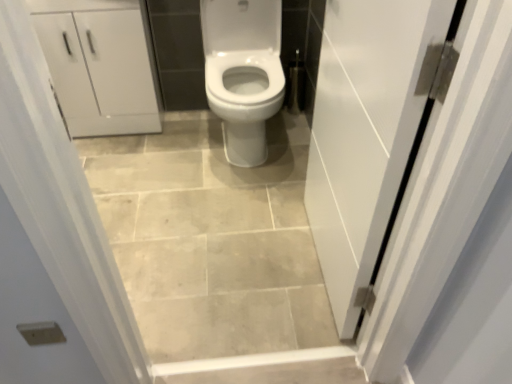
Describe the element at coordinates (99, 69) in the screenshot. The height and width of the screenshot is (384, 512). I see `white matte cabinet at upper left` at that location.

Where is `white matte cabinet at upper left`? The image size is (512, 384). white matte cabinet at upper left is located at coordinates (99, 69).

Identify the location of beige ceramic tile at center. The width and height of the screenshot is (512, 384). (211, 239).

Is point (253, 327) less distant than point (351, 92)?

That is False.

Considering the relative positions of beige ceramic tile at center and white glossy door at right in the image provided, is beige ceramic tile at center to the left of white glossy door at right from the viewer's perspective?

Indeed, beige ceramic tile at center is positioned on the left side of white glossy door at right.

The height and width of the screenshot is (384, 512). Find the location of `door positioned vertically above the beige ceramic tile at center (from a real-world perspective)`. door positioned vertically above the beige ceramic tile at center (from a real-world perspective) is located at coordinates (366, 134).

Which is behind, beige ceramic tile at center or white glossy door at right?

beige ceramic tile at center is further from the camera.

Looking at this image, looking at the image, does white matte cabinet at upper left seem bigger or smaller compared to beige ceramic tile at center?

Clearly, white matte cabinet at upper left is larger in size than beige ceramic tile at center.

From the image's perspective, which object appears higher, white matte cabinet at upper left or beige ceramic tile at center?

white matte cabinet at upper left.

From a real-world perspective, is white matte cabinet at upper left positioned over beige ceramic tile at center based on gravity?

Indeed, from a real-world perspective, white matte cabinet at upper left stands above beige ceramic tile at center.

In the scene shown: Is white glossy door at right to the left of white matte cabinet at upper left from the viewer's perspective?

No.

Does white glossy door at right come in front of white matte cabinet at upper left?

Yes, the depth of white glossy door at right is less than that of white matte cabinet at upper left.

From a real-world perspective, is white glossy door at right positioned above or below white matte cabinet at upper left?

white glossy door at right is situated higher than white matte cabinet at upper left in the real world.

Considering the sizes of objects white glossy door at right and white matte cabinet at upper left in the image provided, who is thinner, white glossy door at right or white matte cabinet at upper left?

Thinner between the two is white glossy door at right.

Considering the sizes of objects white glossy door at right and beige ceramic tile at center in the image provided, who is shorter, white glossy door at right or beige ceramic tile at center?

beige ceramic tile at center is shorter.

Can we say white glossy door at right lies outside beige ceramic tile at center?

white glossy door at right lies outside beige ceramic tile at center's area.

Which is more to the left, white glossy door at right or beige ceramic tile at center?

beige ceramic tile at center.

From a real-world perspective, is white glossy door at right positioned above or below beige ceramic tile at center?

white glossy door at right is situated higher than beige ceramic tile at center in the real world.

Is beige ceramic tile at center positioned with its back to white matte cabinet at upper left?

No, beige ceramic tile at center's orientation is not away from white matte cabinet at upper left.

From a real-world perspective, does beige ceramic tile at center sit lower than white matte cabinet at upper left?

Indeed, from a real-world perspective, beige ceramic tile at center is positioned beneath white matte cabinet at upper left.

Between beige ceramic tile at center and white matte cabinet at upper left, which one has larger width?

Wider between the two is beige ceramic tile at center.

Considering the sizes of white matte cabinet at upper left and white glossy door at right in the image, is white matte cabinet at upper left bigger or smaller than white glossy door at right?

white matte cabinet at upper left is bigger than white glossy door at right.

From the picture: Would you say white matte cabinet at upper left is outside white glossy door at right?

Indeed, white matte cabinet at upper left is completely outside white glossy door at right.

Where is `door in front of the white matte cabinet at upper left`? The width and height of the screenshot is (512, 384). door in front of the white matte cabinet at upper left is located at coordinates (366, 134).

Which is behind, point (131, 117) or point (325, 203)?

Point (131, 117)

Where is `door above the beige ceramic tile at center (from a real-world perspective)`? The width and height of the screenshot is (512, 384). door above the beige ceramic tile at center (from a real-world perspective) is located at coordinates (366, 134).

Identify the location of cabinetry lying on the left of beige ceramic tile at center. (99, 69).

Which object lies further to the anchor point beige ceramic tile at center, white glossy door at right or white matte cabinet at upper left?

The object further to beige ceramic tile at center is white glossy door at right.

Which object lies nearer to the anchor point white matte cabinet at upper left, white glossy door at right or beige ceramic tile at center?

beige ceramic tile at center lies closer to white matte cabinet at upper left than the other object.

Estimate the real-world distances between objects in this image. Which object is further from white matte cabinet at upper left, beige ceramic tile at center or white glossy door at right?

white glossy door at right is further to white matte cabinet at upper left.

Considering their positions, is white matte cabinet at upper left positioned further to beige ceramic tile at center than white glossy door at right?

Among the two, white glossy door at right is located further to beige ceramic tile at center.

From the image, which object appears to be farther from white glossy door at right, beige ceramic tile at center or white matte cabinet at upper left?

Among the two, white matte cabinet at upper left is located further to white glossy door at right.

Considering their positions, is white matte cabinet at upper left positioned further to white glossy door at right than beige ceramic tile at center?

white matte cabinet at upper left.

At what (x,y) coordinates should I click in order to perform the action: click on ceramic tile between white glossy door at right and white matte cabinet at upper left along the z-axis. Please return your answer as a coordinate pair (x, y). Looking at the image, I should click on (211, 239).